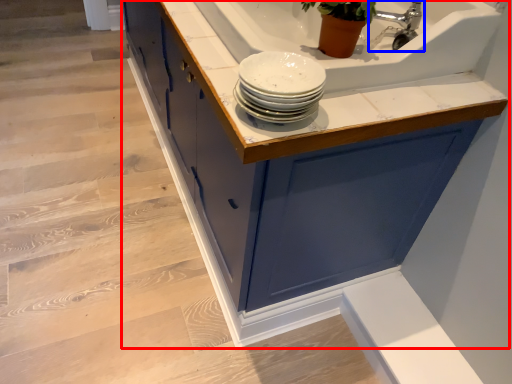
Question: Which of the following is the farthest to the observer, cabinetry (highlighted by a red box) or tap (highlighted by a blue box)?

Choices:
 (A) cabinetry
 (B) tap

Answer: (B)